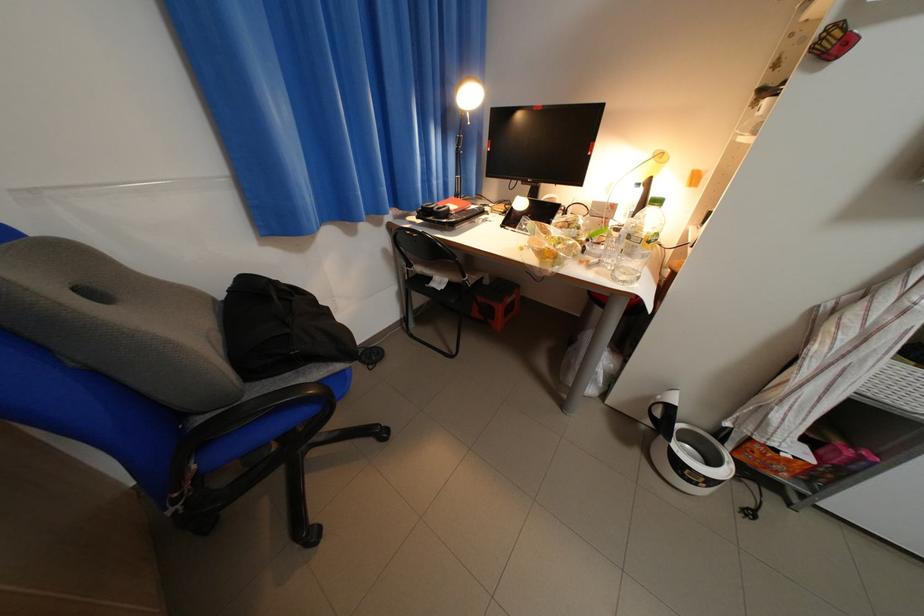
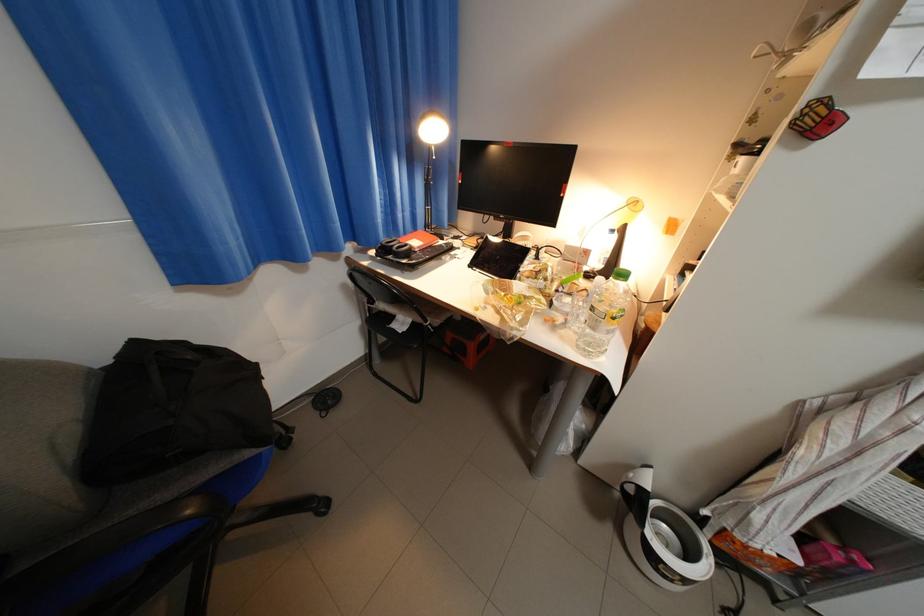
Find the pixel in the second image that matches (396,252) in the first image.

(355, 286)